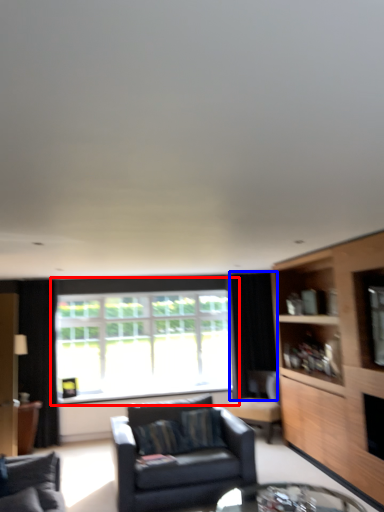
Question: Which of the following is the farthest to the observer, window (highlighted by a red box) or curtain (highlighted by a blue box)?

Choices:
 (A) window
 (B) curtain

Answer: (B)